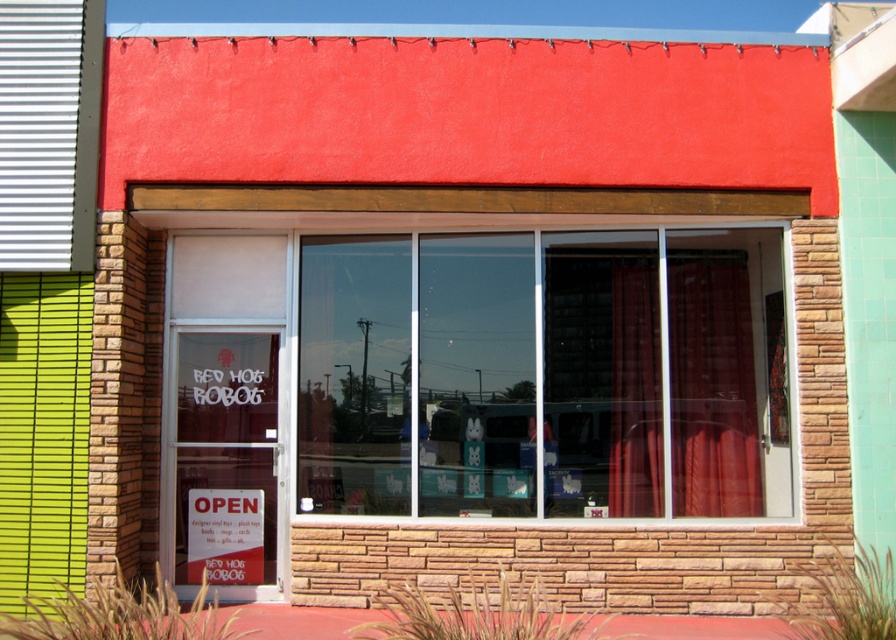
You are standing in front of the storefront and want to see the items inside. Where should you look to see the transparent glass window at center?

You should look at the point with coordinates (543,374) to see the transparent glass window at center.

You are standing outside the store looking at the storefront. There is a point at coordinate (712, 385). What object is located at that point?

The point at coordinate (712, 385) is occupied by the red velvet curtain at center.